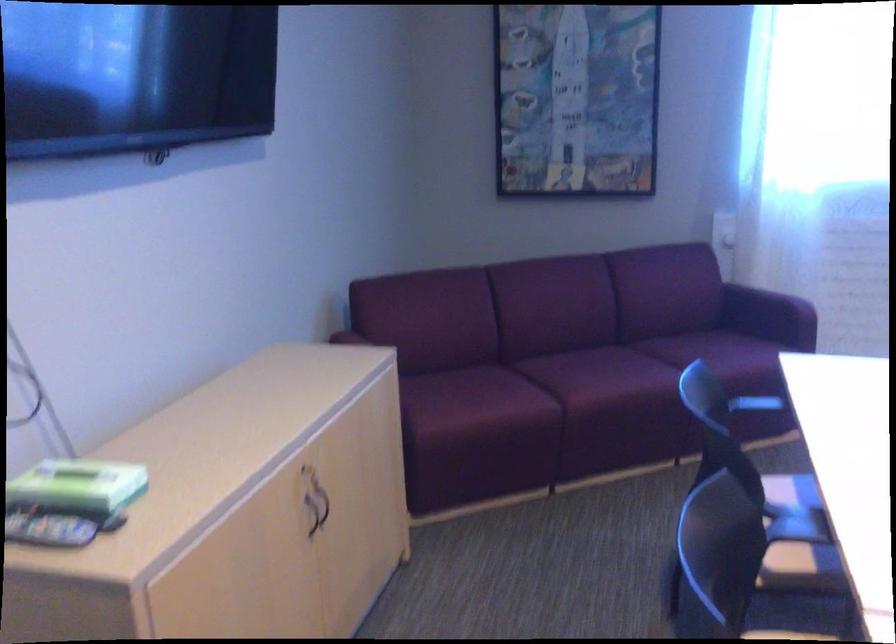
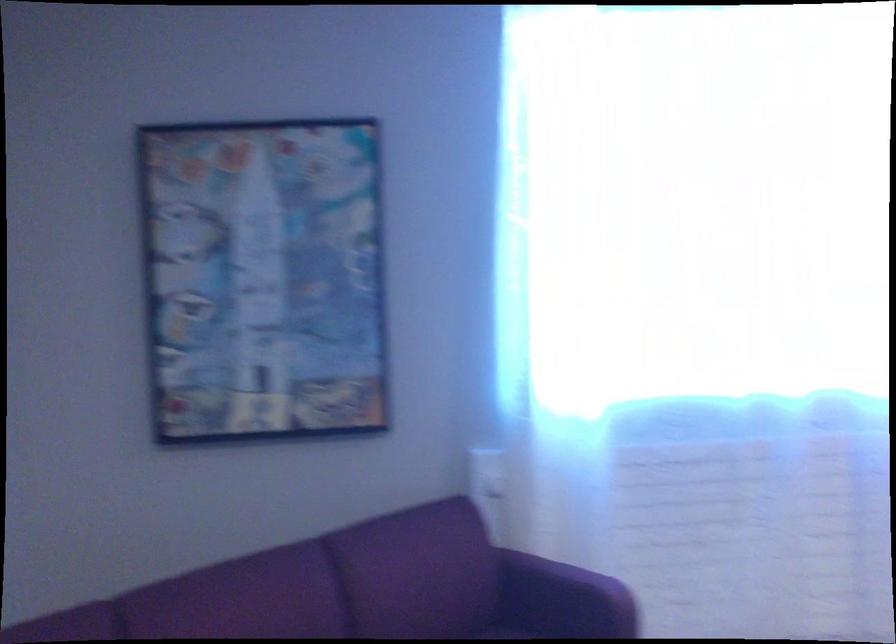
Question: What movement of the cameraman would produce the second image?

Choices:
 (A) Left
 (B) Right
 (C) Forward
 (D) Backward

Answer: (C)